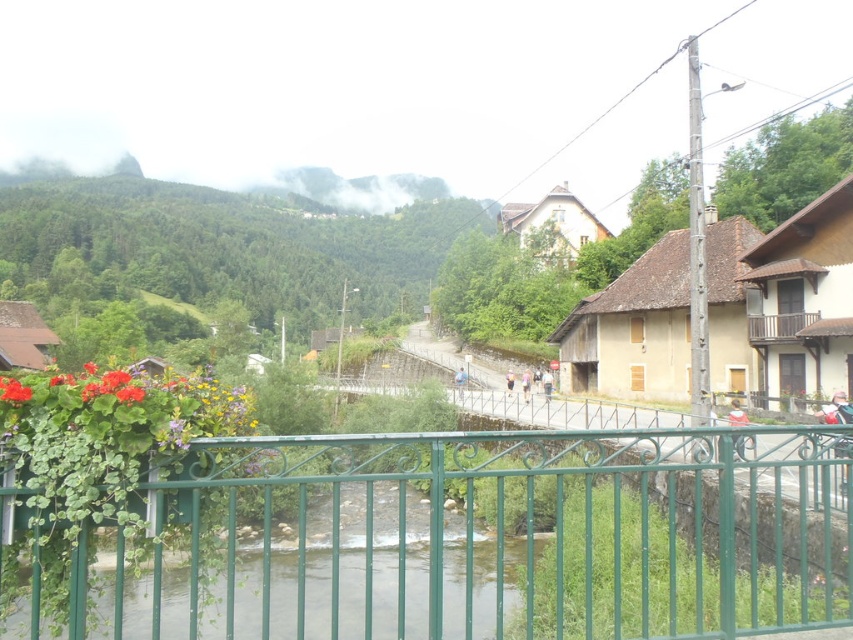
You are a drone operator who needs to deliver a package from the wooden house at center right to the matte red flower at lower left. Given that your drone can carry a maximum weight of 2 kilograms and has a battery that allows it to fly 35 meters before needing to recharge, will you be able to complete the delivery without needing to recharge?

The wooden house at center right and the matte red flower at lower left are 34.95 meters apart. Since the drone can fly 35 meters before needing to recharge, it can complete the delivery without needing to recharge as the distance is just under the maximum range.

You are standing on the bridge and want to take a photo of the green wrought iron fence at center. According to the coordinates provided, where exactly should you aim your camera to capture it?

You should aim your camera at point (456, 540) to capture the green wrought iron fence at center.